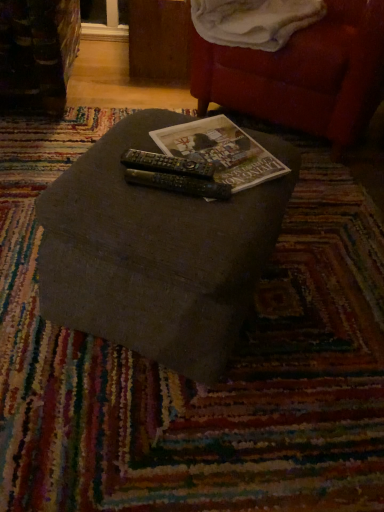
Question: Does matte paper book at center come behind black plastic remote at center, the 2th remote viewed from the front?

Choices:
 (A) yes
 (B) no

Answer: (B)

Question: From the image's perspective, is matte paper book at center located beneath black plastic remote at center, the 2th remote viewed from the front?

Choices:
 (A) no
 (B) yes

Answer: (A)

Question: Can you confirm if matte paper book at center is bigger than black plastic remote at center, the 2th remote viewed from the front?

Choices:
 (A) yes
 (B) no

Answer: (A)

Question: Does matte paper book at center have a greater width compared to black plastic remote at center, the 2th remote viewed from the front?

Choices:
 (A) yes
 (B) no

Answer: (B)

Question: Is there a large distance between matte paper book at center and black plastic remote at center, the 2th remote viewed from the front?

Choices:
 (A) yes
 (B) no

Answer: (B)

Question: Can you confirm if matte paper book at center is shorter than black plastic remote at center, the 1th remote in the back-to-front sequence?

Choices:
 (A) no
 (B) yes

Answer: (B)

Question: From a real-world perspective, does black plastic remote at center, acting as the second remote starting from the back, sit lower than velvet red bean bag chair at upper right?

Choices:
 (A) no
 (B) yes

Answer: (A)

Question: Is black plastic remote at center, acting as the second remote starting from the back, thinner than velvet red bean bag chair at upper right?

Choices:
 (A) yes
 (B) no

Answer: (A)

Question: Does black plastic remote at center, acting as the second remote starting from the back, have a lesser height compared to velvet red bean bag chair at upper right?

Choices:
 (A) yes
 (B) no

Answer: (A)

Question: Is black plastic remote at center, arranged as the first remote when viewed from the front, looking in the opposite direction of velvet red bean bag chair at upper right?

Choices:
 (A) yes
 (B) no

Answer: (B)

Question: Does black plastic remote at center, acting as the second remote starting from the back, appear on the left side of velvet red bean bag chair at upper right?

Choices:
 (A) yes
 (B) no

Answer: (A)

Question: Could velvet red bean bag chair at upper right be considered to be inside black plastic remote at center, acting as the second remote starting from the back?

Choices:
 (A) no
 (B) yes

Answer: (A)

Question: From a real-world perspective, is velvet red bean bag chair at upper right positioned under black plastic remote at center, arranged as the first remote when viewed from the front, based on gravity?

Choices:
 (A) yes
 (B) no

Answer: (A)